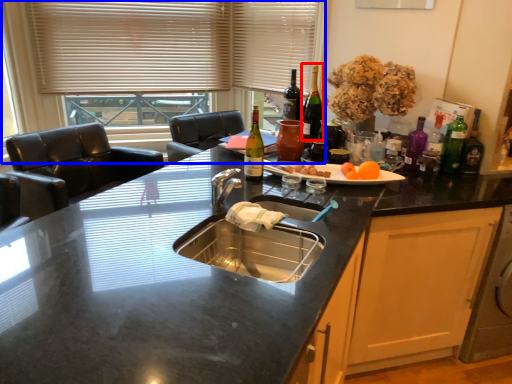
Question: Which object is further to the camera taking this photo, wine bottle (highlighted by a red box) or window (highlighted by a blue box)?

Choices:
 (A) wine bottle
 (B) window

Answer: (B)